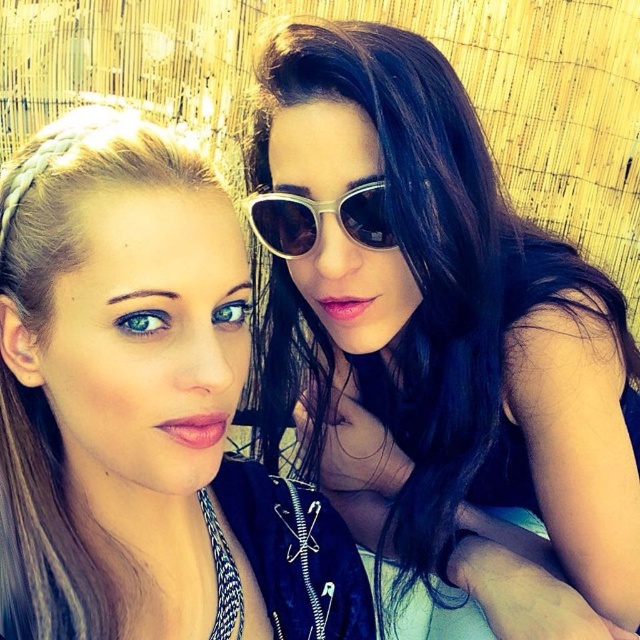
Question: Can you confirm if satin black dress at upper right is positioned above metallic silver sunglasses at center?

Choices:
 (A) yes
 (B) no

Answer: (B)

Question: Considering the real-world distances, which object is closest to the metallic silver sunglasses at center?

Choices:
 (A) satin black dress at upper right
 (B) matte black jacket at upper left

Answer: (A)

Question: Which object is the farthest from the metallic silver sunglasses at center?

Choices:
 (A) satin black dress at upper right
 (B) matte black jacket at upper left

Answer: (B)

Question: Is satin black dress at upper right positioned before matte black jacket at upper left?

Choices:
 (A) no
 (B) yes

Answer: (A)

Question: Which point appears closest to the camera in this image?

Choices:
 (A) (301, 218)
 (B) (515, 525)

Answer: (A)

Question: Is matte black jacket at upper left wider than metallic silver sunglasses at center?

Choices:
 (A) no
 (B) yes

Answer: (B)